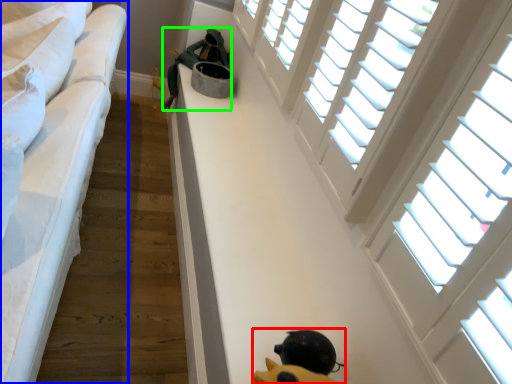
Question: Which object is positioned farthest from toy (highlighted by a red box)? Select from furniture (highlighted by a blue box) and person (highlighted by a green box).

Choices:
 (A) furniture
 (B) person

Answer: (B)